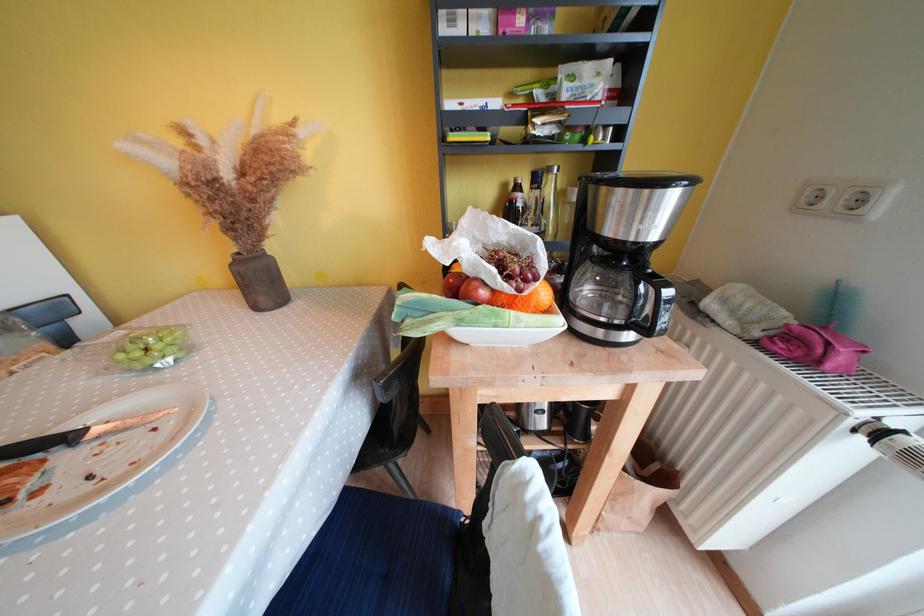
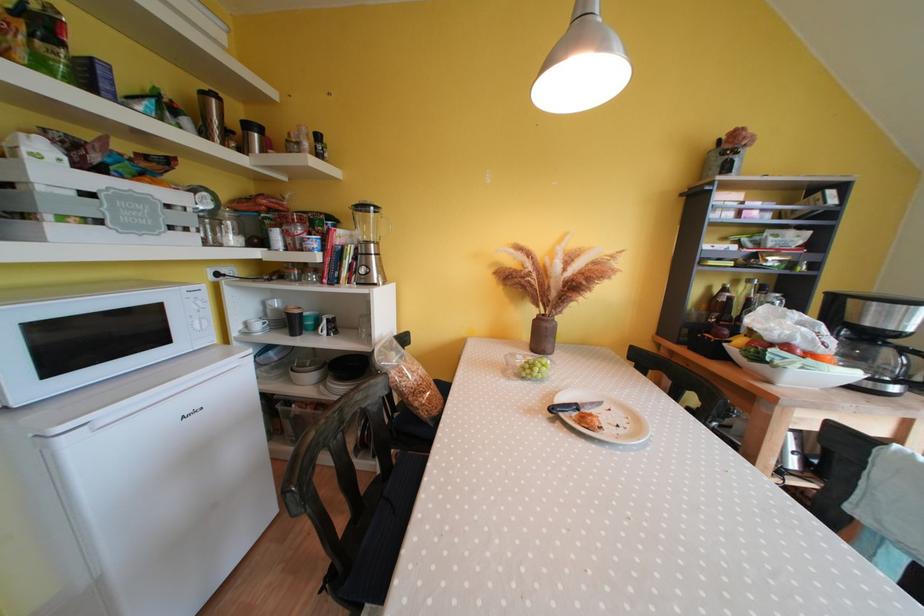
Locate, in the second image, the point that corresponds to pixel 98 480 in the first image.

(624, 430)